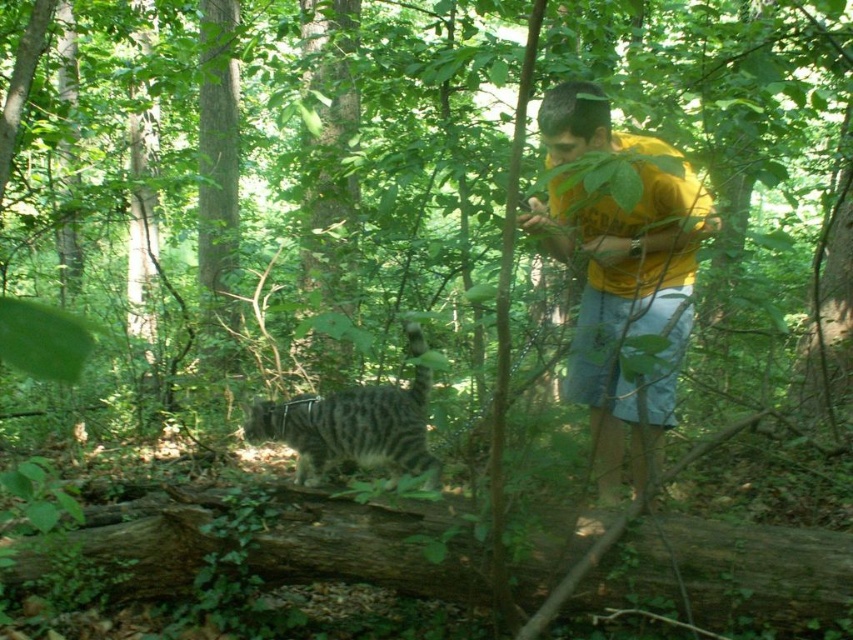
Question: Which object is closer to the camera taking this photo?

Choices:
 (A) striped fur cat at center
 (B) yellow cotton shirt at center

Answer: (B)

Question: Does yellow cotton shirt at center appear over striped fur cat at center?

Choices:
 (A) no
 (B) yes

Answer: (B)

Question: Which of the following is the closest to the observer?

Choices:
 (A) (427, 531)
 (B) (274, 426)

Answer: (A)

Question: Is yellow cotton shirt at center below striped fur cat at center?

Choices:
 (A) yes
 (B) no

Answer: (B)

Question: Does brown rough log at lower center appear under yellow cotton shirt at center?

Choices:
 (A) no
 (B) yes

Answer: (B)

Question: Which point is closer to the camera?

Choices:
 (A) brown rough log at lower center
 (B) yellow cotton shirt at center
 (C) striped fur cat at center

Answer: (B)